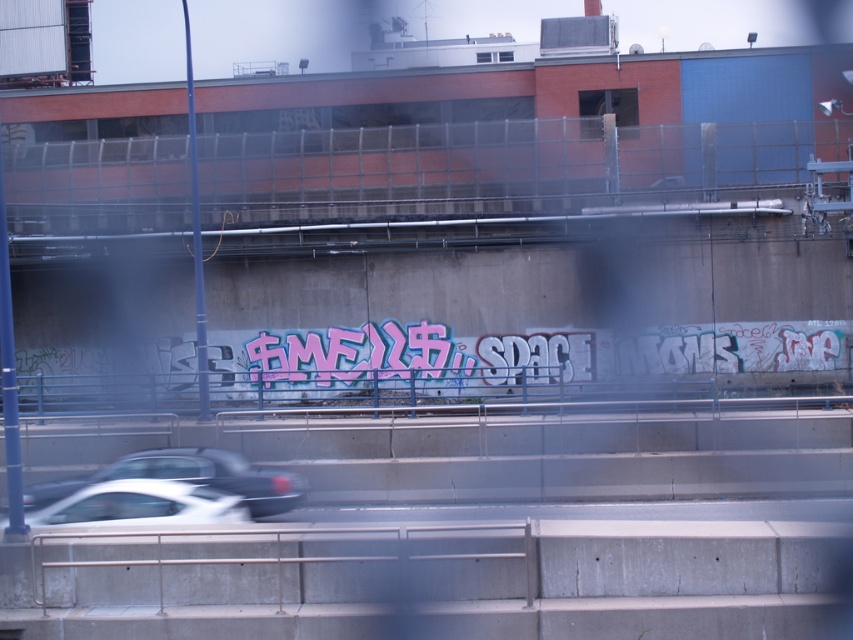
You are a photographer trying to capture the blue metal fence at center and the white glossy car at lower center in a single frame. Based on their sizes, which object should you focus on to ensure both are fully visible in the photo?

The blue metal fence at center is wider than the white glossy car at lower center, so you should focus on the blue metal fence at center to ensure both objects are fully visible in the photo.